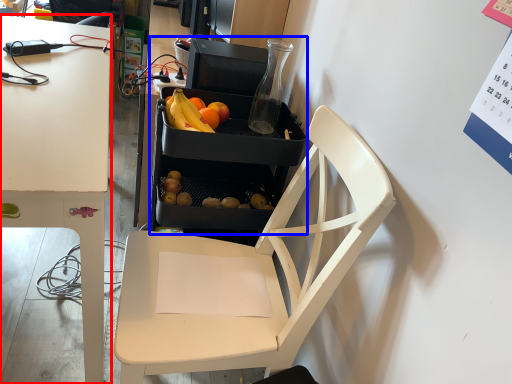
Question: Among these objects, which one is nearest to the camera, desk (highlighted by a red box) or appliance (highlighted by a blue box)?

Choices:
 (A) desk
 (B) appliance

Answer: (A)